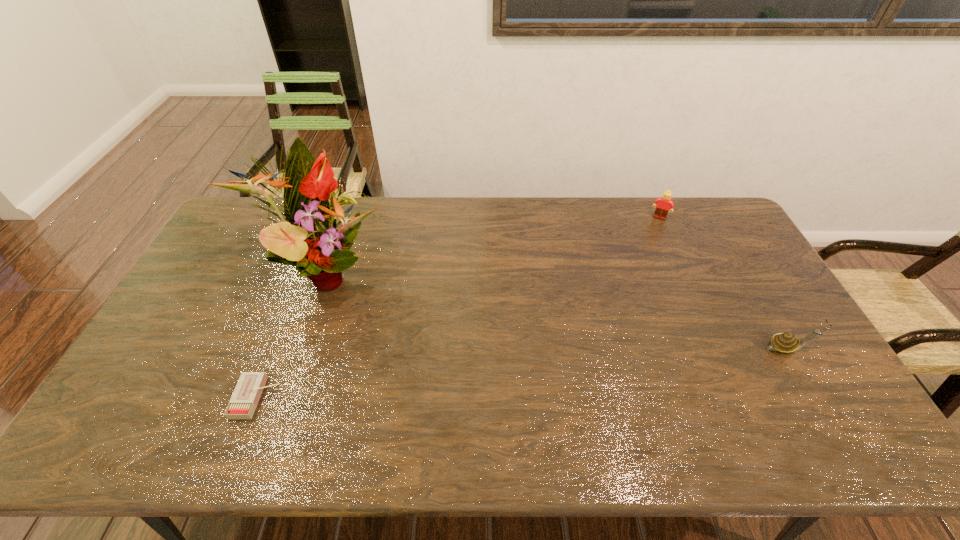
Find the location of `free space located on the face of the Lego`. free space located on the face of the Lego is located at coordinates click(x=635, y=270).

At what (x,y) coordinates should I click in order to perform the action: click on free space located 0.210m on the face of the Lego. Please return your answer as a coordinate pair (x, y). The width and height of the screenshot is (960, 540). Looking at the image, I should click on (641, 255).

This screenshot has width=960, height=540. I want to click on vacant space located 0.220m on the front-facing side of the third nearest object, so click(438, 314).

Locate an element on the screen. This screenshot has width=960, height=540. free space located 0.230m on the front-facing side of the third nearest object is located at coordinates (441, 315).

Where is `free space located 0.230m on the front-facing side of the third nearest object`? The width and height of the screenshot is (960, 540). free space located 0.230m on the front-facing side of the third nearest object is located at coordinates (441, 315).

Find the location of a particular element. The width and height of the screenshot is (960, 540). object at the far edge is located at coordinates (665, 202).

Where is `object present at the near edge`? object present at the near edge is located at coordinates (244, 400).

Where is `object at the right edge`? This screenshot has width=960, height=540. object at the right edge is located at coordinates (786, 343).

Where is `free space at the far edge of the desktop`? Image resolution: width=960 pixels, height=540 pixels. free space at the far edge of the desktop is located at coordinates (595, 227).

In the image, there is a desktop. Where is `vacant space at the near edge`? vacant space at the near edge is located at coordinates (619, 394).